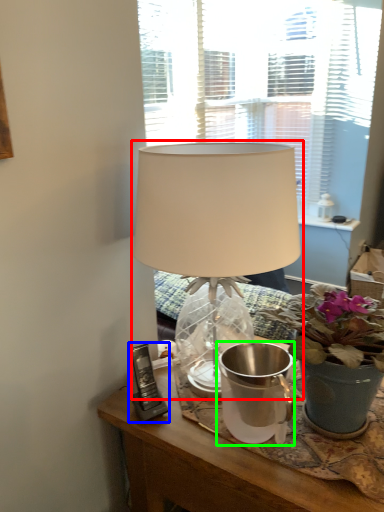
Question: Based on their relative distances, which object is nearer to lamp (highlighted by a red box)? Choose from gadget (highlighted by a blue box) and watering can (highlighted by a green box).

Choices:
 (A) gadget
 (B) watering can

Answer: (B)